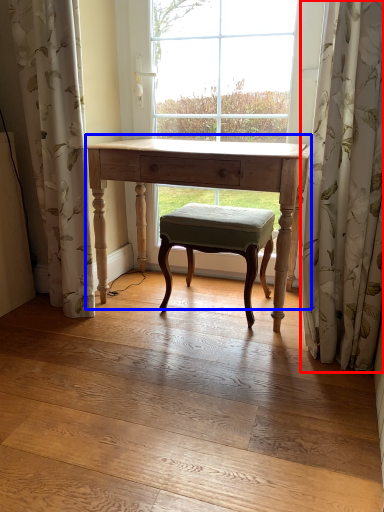
Question: Among these objects, which one is farthest to the camera, curtain (highlighted by a red box) or table (highlighted by a blue box)?

Choices:
 (A) curtain
 (B) table

Answer: (B)